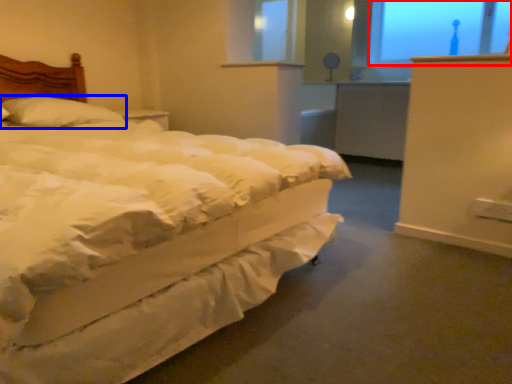
Question: Which of the following is the farthest to the observer, window screen (highlighted by a red box) or pillow (highlighted by a blue box)?

Choices:
 (A) window screen
 (B) pillow

Answer: (A)